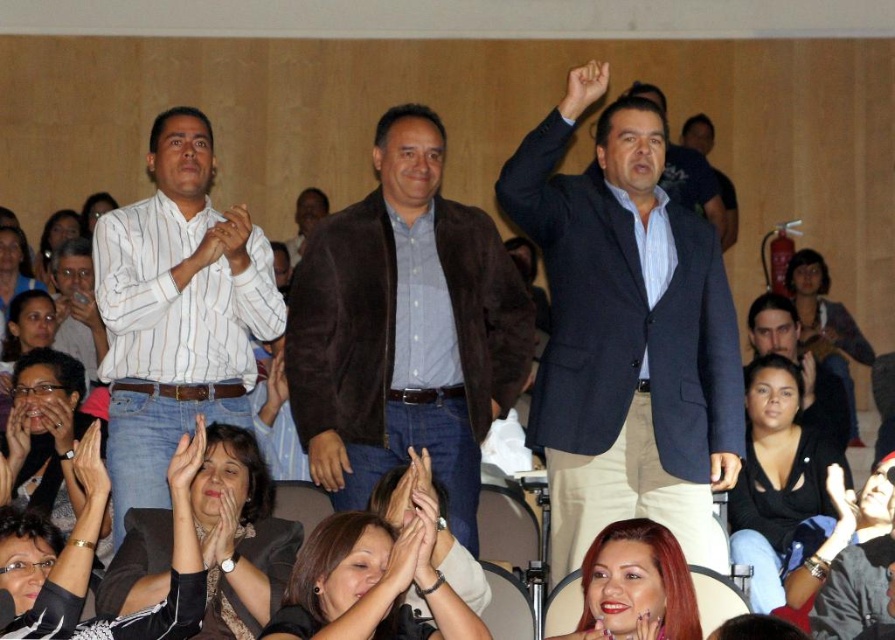
You are standing at the point labeled point (618, 458) in a conference room. You want to take a photo of the entire room using a camera that has a maximum range of 10 meters. Will the camera be able to capture the entire room from your current position?

The distance between point (618, 458) and the camera is 9.80 meters, which is within the camera maximum range of 10 meters. Therefore, the camera can capture the entire room from your current position.

You are standing at the camera position and want to hand a document to the person wearing the white striped shirt at center. Can you reach them without moving from your current position?

The white striped shirt at center is 42.61 feet away from camera, so you cannot reach them without moving from your current position.